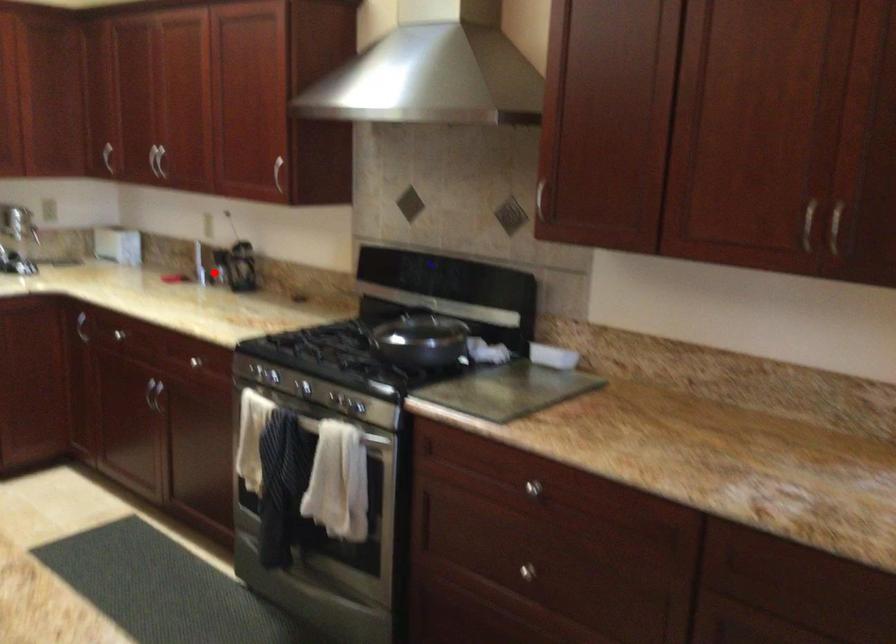
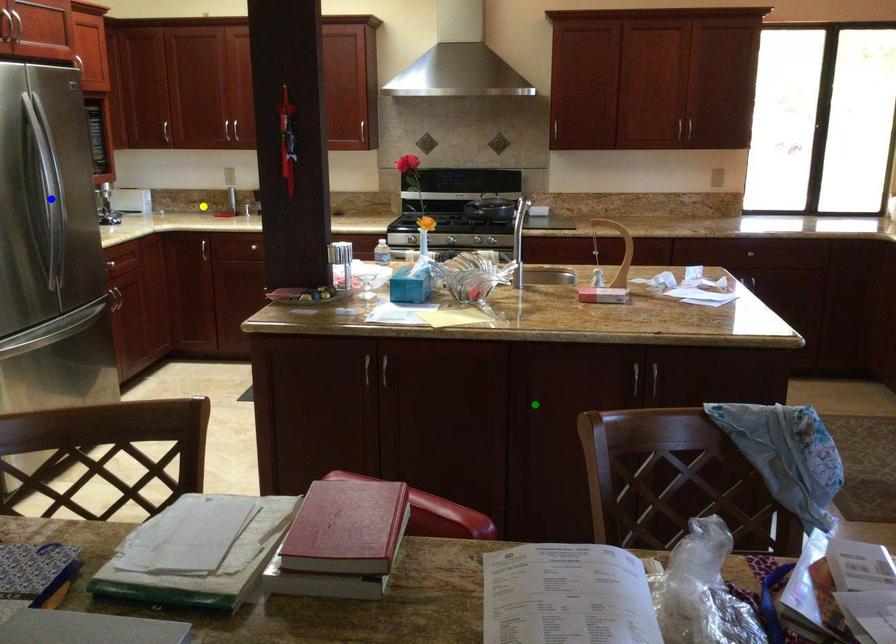
Question: I am providing you with two images of the same scene from different viewpoints. A red point is marked on the first image. You are given multiple points on the second image. In image 2, which mark is for the same physical point as the one in image 1?

Choices:
 (A) green point
 (B) blue point
 (C) yellow point

Answer: (C)